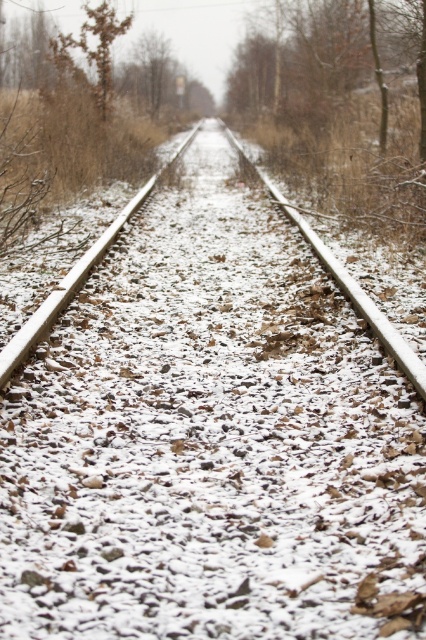
You are standing at the base of the brown wood tree at upper center and want to walk to a cabin located 50 feet away in the direction opposite the tree. Will you have to walk past the tree to reach the cabin?

The brown wood tree at upper center is 34.96 feet away from the viewer. Since the cabin is 50 feet away in the opposite direction, you will have to walk past the tree to reach the cabin.